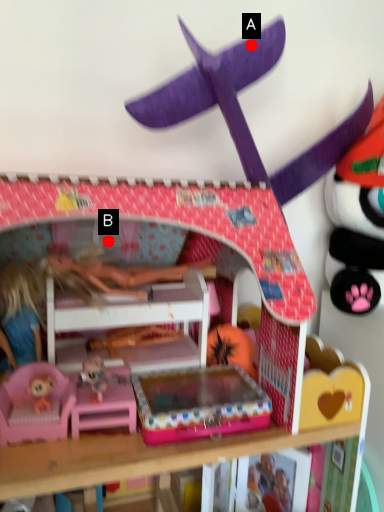
Question: Two points are circled on the image, labeled by A and B beside each circle. Which point is farther from the camera taking this photo?

Choices:
 (A) A is further
 (B) B is further

Answer: (B)